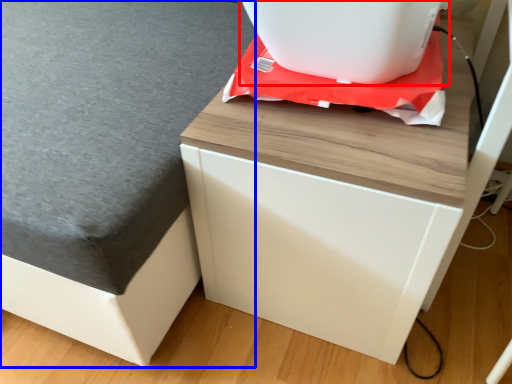
Question: Which object appears closest to the camera in this image, appliance (highlighted by a red box) or table top (highlighted by a blue box)?

Choices:
 (A) appliance
 (B) table top

Answer: (B)